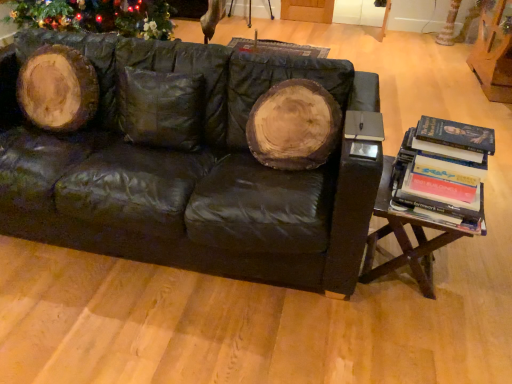
Question: Is hardcover books at right beside black leather couch at center?

Choices:
 (A) no
 (B) yes

Answer: (A)

Question: From a real-world perspective, is hardcover books at right on black leather couch at center?

Choices:
 (A) yes
 (B) no

Answer: (A)

Question: Can you confirm if hardcover books at right is positioned to the left of black leather couch at center?

Choices:
 (A) yes
 (B) no

Answer: (B)

Question: Is hardcover books at right closer to the viewer compared to black leather couch at center?

Choices:
 (A) yes
 (B) no

Answer: (B)

Question: Does hardcover books at right lie behind black leather couch at center?

Choices:
 (A) yes
 (B) no

Answer: (A)

Question: Considering their positions, is white textured tree trunk at upper right located in front of or behind matte black book at right?

Choices:
 (A) behind
 (B) front

Answer: (A)

Question: From the image's perspective, relative to matte black book at right, is white textured tree trunk at upper right above or below?

Choices:
 (A) above
 (B) below

Answer: (A)

Question: Looking at the image, does white textured tree trunk at upper right seem bigger or smaller compared to matte black book at right?

Choices:
 (A) big
 (B) small

Answer: (A)

Question: Which is correct: white textured tree trunk at upper right is inside matte black book at right, or outside of it?

Choices:
 (A) outside
 (B) inside

Answer: (A)

Question: From the image's perspective, relative to white textured tree trunk at upper right, is hardcover books at right above or below?

Choices:
 (A) below
 (B) above

Answer: (A)

Question: From a real-world perspective, is hardcover books at right physically located above or below white textured tree trunk at upper right?

Choices:
 (A) below
 (B) above

Answer: (B)

Question: Do you think hardcover books at right is within white textured tree trunk at upper right, or outside of it?

Choices:
 (A) outside
 (B) inside

Answer: (A)

Question: Looking at the image, does hardcover books at right seem bigger or smaller compared to white textured tree trunk at upper right?

Choices:
 (A) small
 (B) big

Answer: (A)

Question: Considering the relative positions of matte black book at right and woodenmaterial/texturetable at right in the image provided, is matte black book at right to the left or to the right of woodenmaterial/texturetable at right?

Choices:
 (A) right
 (B) left

Answer: (B)

Question: From the image's perspective, is matte black book at right above or below woodenmaterial/texturetable at right?

Choices:
 (A) below
 (B) above

Answer: (B)